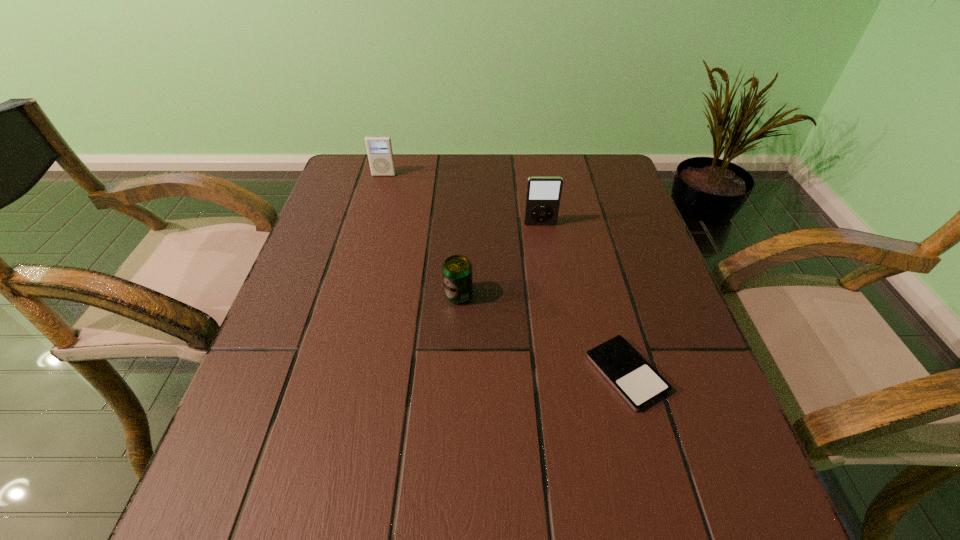
You are a GUI agent. You are given a task and a screenshot of the screen. Output one action in this format:
    pyautogui.click(x=<x>, y=<y>)
    Task: Click on the vacant area at the far right corner of the desktop
    Image resolution: width=960 pixels, height=540 pixels.
    Given the screenshot: What is the action you would take?
    pyautogui.click(x=565, y=164)

Locate an element on the screen. This screenshot has width=960, height=540. blank area at the near right corner is located at coordinates (721, 518).

Where is `vacant region between the second object from left to right and the second object from right to left`? This screenshot has width=960, height=540. vacant region between the second object from left to right and the second object from right to left is located at coordinates click(499, 260).

At what (x,y) coordinates should I click in order to perform the action: click on vacant area between the third object from left to right and the third tallest object. Please return your answer as a coordinate pair (x, y). The width and height of the screenshot is (960, 540). Looking at the image, I should click on (499, 260).

The image size is (960, 540). I want to click on free space between the rightmost object and the second shortest object, so click(542, 334).

Where is `vacant point located between the farthest object and the third object from left to right`? vacant point located between the farthest object and the third object from left to right is located at coordinates (462, 200).

Where is `free space between the shortest object and the third object from right to left`? The image size is (960, 540). free space between the shortest object and the third object from right to left is located at coordinates (542, 334).

At what (x,y) coordinates should I click in order to perform the action: click on free space between the leftmost iPod and the shortest iPod. Please return your answer as a coordinate pair (x, y). Image resolution: width=960 pixels, height=540 pixels. Looking at the image, I should click on (505, 274).

Locate an element on the screen. free area in between the leftmost iPod and the nearest object is located at coordinates (505, 274).

Find the location of a particular element. This screenshot has height=540, width=960. blank region between the second farthest object and the leftmost object is located at coordinates [462, 200].